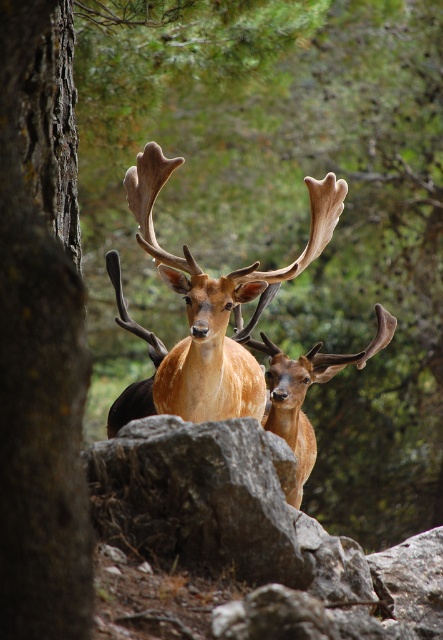
You are a wildlife photographer aiming to capture a closeup of the golden fur antlers at center and the shiny brown antlers at center. Since you want to focus on both, which deer should you adjust your camera to focus on first based on their positions?

The golden fur antlers at center is above shiny brown antlers at center, so you should focus on the golden fur antlers at center first as it is closer to the camera.

You are a photographer trying to capture both the rough bark tree at left and the golden fur antlers at center in a single frame. Based on their widths, which object should you focus on to ensure both fit in the frame?

The rough bark tree at left is narrower than the golden fur antlers at center, so focusing on the golden fur antlers at center would allow both to fit in the frame since it is wider and occupies more space.